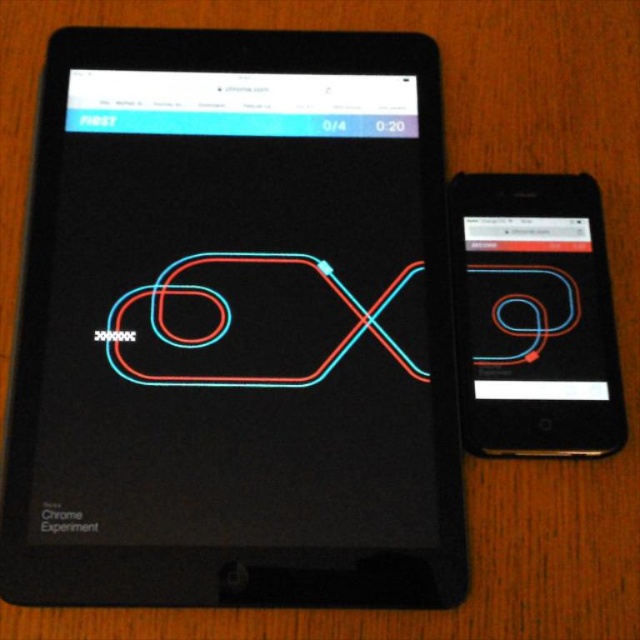
Is black glossy tablet at upper left thinner than matte black phone at right?

No.

Does point (387, 349) lie in front of point (573, 184)?

Yes, it is in front of point (573, 184).

Between point (387, 436) and point (570, 413), which one is positioned in front?

Positioned in front is point (570, 413).

The image size is (640, 640). In order to click on black glossy tablet at upper left in this screenshot , I will do `click(234, 326)`.